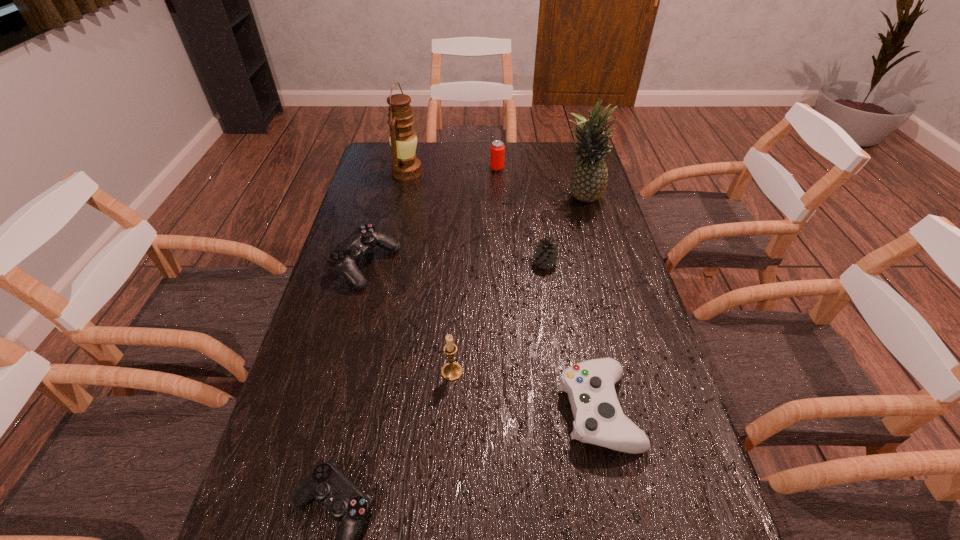
I want to click on the rightmost control, so click(x=598, y=417).

I want to click on the second farthest control, so click(x=598, y=417).

Where is `free space located 0.150m on the back of the oil lamp`? free space located 0.150m on the back of the oil lamp is located at coordinates (414, 143).

The image size is (960, 540). I want to click on free space located 0.190m on the left of the sixth nearest object, so click(504, 198).

Where is `vacant region located on the left of the fourth object from left to right`? This screenshot has height=540, width=960. vacant region located on the left of the fourth object from left to right is located at coordinates (328, 372).

This screenshot has height=540, width=960. I want to click on vacant space positioned 0.160m on the front of the fifth object from left to right, so click(x=498, y=197).

Locate an element on the screen. The width and height of the screenshot is (960, 540). vacant area located on the back of the pinecone is located at coordinates (536, 206).

The width and height of the screenshot is (960, 540). I want to click on vacant area located on the back of the bigger black control, so click(x=378, y=219).

The width and height of the screenshot is (960, 540). Identify the location of vacant space located 0.280m on the left of the second farthest control. (435, 410).

Where is `oil lamp that is at the far edge`? oil lamp that is at the far edge is located at coordinates (405, 166).